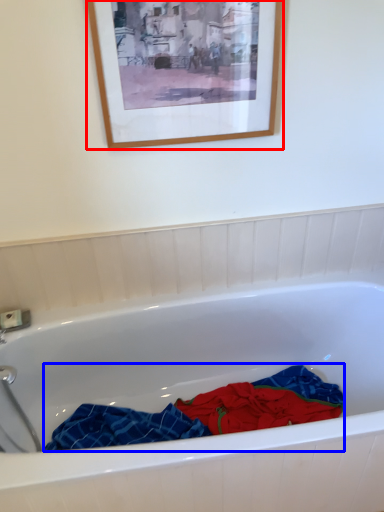
Question: Which of the following is the closest to the observer, picture frame (highlighted by a red box) or material (highlighted by a blue box)?

Choices:
 (A) picture frame
 (B) material

Answer: (A)